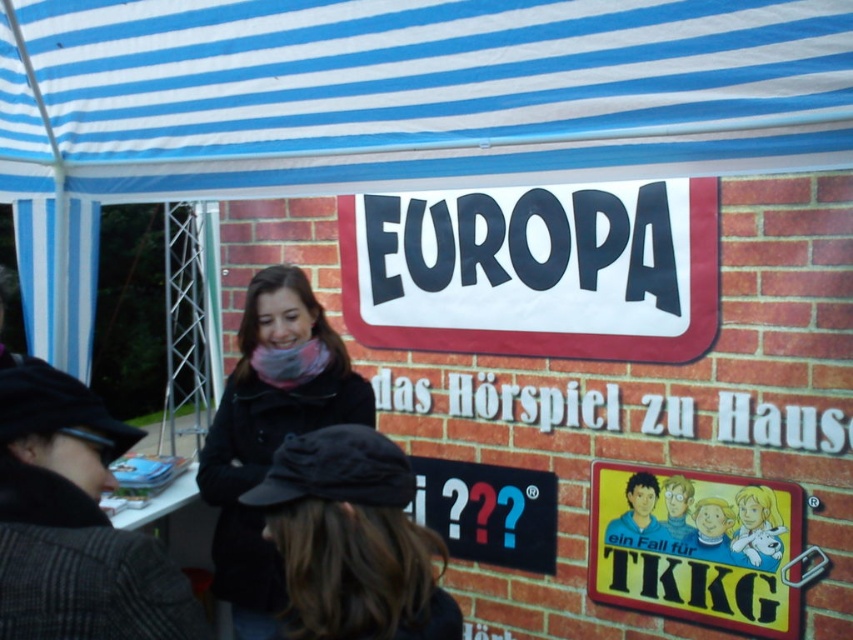
Between black plastic sign at center and black matte coat at center, which one has less height?

black plastic sign at center is shorter.

What do you see at coordinates (537, 269) in the screenshot?
I see `black plastic sign at center` at bounding box center [537, 269].

The image size is (853, 640). Identify the location of black plastic sign at center. (537, 269).

Does blue striped canopy at upper center appear under black fabric cap at center?

Incorrect, blue striped canopy at upper center is not positioned below black fabric cap at center.

Describe the element at coordinates (410, 92) in the screenshot. I see `blue striped canopy at upper center` at that location.

Locate an element on the screen. The image size is (853, 640). blue striped canopy at upper center is located at coordinates (410, 92).

Is point (717, 500) positioned in front of point (256, 616)?

No, it is not.

Who is higher up, yellow cardboard sign at lower right or black matte coat at center?

black matte coat at center is higher up.

Consider the image. Who is more forward, (799,600) or (239,508)?

Point (239,508) is in front.

At what (x,y) coordinates should I click in order to perform the action: click on yellow cardboard sign at lower right. Please return your answer as a coordinate pair (x, y). The image size is (853, 640). Looking at the image, I should click on (695, 547).